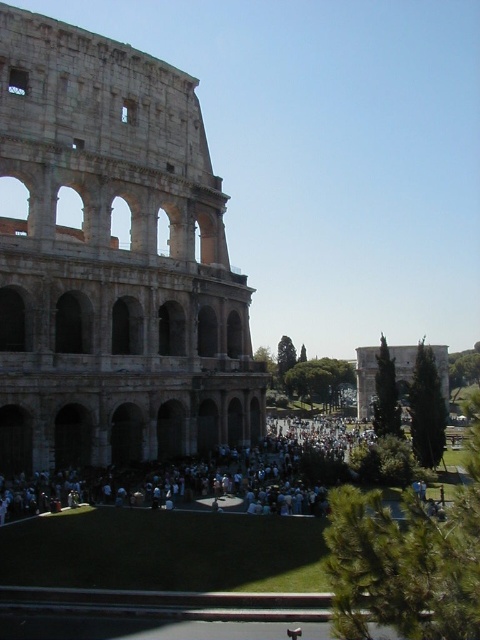
Who is lower down, stone amphitheater at left or white cloth crowd at center?

Positioned lower is white cloth crowd at center.

Describe the element at coordinates (113, 260) in the screenshot. I see `stone amphitheater at left` at that location.

Between point (157, 104) and point (321, 477), which one is positioned in front?

Point (321, 477) is in front.

Where is `stone amphitheater at left`? The width and height of the screenshot is (480, 640). stone amphitheater at left is located at coordinates (113, 260).